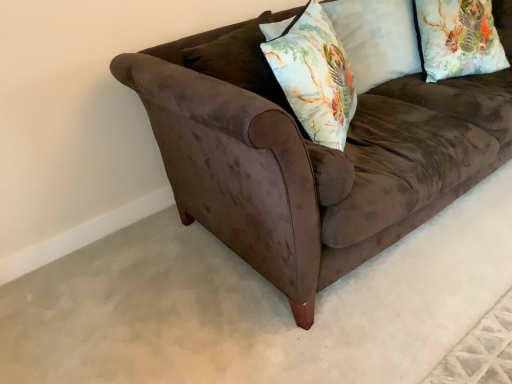
Question: Is floral fabric pillow at upper right, the 2th pillow when ordered from left to right, far from brown velvet couch at center?

Choices:
 (A) no
 (B) yes

Answer: (A)

Question: From the image's perspective, is floral fabric pillow at upper right, placed as the 1th pillow when sorted from right to left, below brown velvet couch at center?

Choices:
 (A) no
 (B) yes

Answer: (A)

Question: Is floral fabric pillow at upper right, the 2th pillow when ordered from left to right, at the right side of brown velvet couch at center?

Choices:
 (A) no
 (B) yes

Answer: (B)

Question: Does floral fabric pillow at upper right, placed as the 1th pillow when sorted from right to left, have a lesser width compared to brown velvet couch at center?

Choices:
 (A) no
 (B) yes

Answer: (B)

Question: Could brown velvet couch at center be considered to be inside floral fabric pillow at upper right, the 2th pillow when ordered from left to right?

Choices:
 (A) yes
 (B) no

Answer: (B)

Question: Is floral fabric pillow at center wider or thinner than brown velvet couch at center?

Choices:
 (A) thin
 (B) wide

Answer: (A)

Question: From a real-world perspective, relative to brown velvet couch at center, is floral fabric pillow at center vertically above or below?

Choices:
 (A) below
 (B) above

Answer: (B)

Question: From their relative heights in the image, would you say floral fabric pillow at center is taller or shorter than brown velvet couch at center?

Choices:
 (A) short
 (B) tall

Answer: (A)

Question: Is point (314, 14) closer or farther from the camera than point (287, 168)?

Choices:
 (A) closer
 (B) farther

Answer: (B)

Question: Considering the positions of brown velvet couch at center and floral fabric pillow at upper right, the 2th pillow when ordered from left to right, in the image, is brown velvet couch at center wider or thinner than floral fabric pillow at upper right, the 2th pillow when ordered from left to right,?

Choices:
 (A) thin
 (B) wide

Answer: (B)

Question: Is brown velvet couch at center taller or shorter than floral fabric pillow at upper right, the 2th pillow when ordered from left to right?

Choices:
 (A) short
 (B) tall

Answer: (B)

Question: Looking at the image, does brown velvet couch at center seem bigger or smaller compared to floral fabric pillow at upper right, placed as the 1th pillow when sorted from right to left?

Choices:
 (A) big
 (B) small

Answer: (A)

Question: Is brown velvet couch at center in front of or behind floral fabric pillow at upper right, the 2th pillow when ordered from left to right, in the image?

Choices:
 (A) front
 (B) behind

Answer: (A)

Question: Considering the positions of floral fabric pillow at upper right, placed as the 1th pillow when sorted from right to left, and floral fabric pillow at center in the image, is floral fabric pillow at upper right, placed as the 1th pillow when sorted from right to left, bigger or smaller than floral fabric pillow at center?

Choices:
 (A) big
 (B) small

Answer: (A)

Question: Would you say floral fabric pillow at upper right, the 2th pillow when ordered from left to right, is to the left or to the right of floral fabric pillow at center in the picture?

Choices:
 (A) right
 (B) left

Answer: (A)